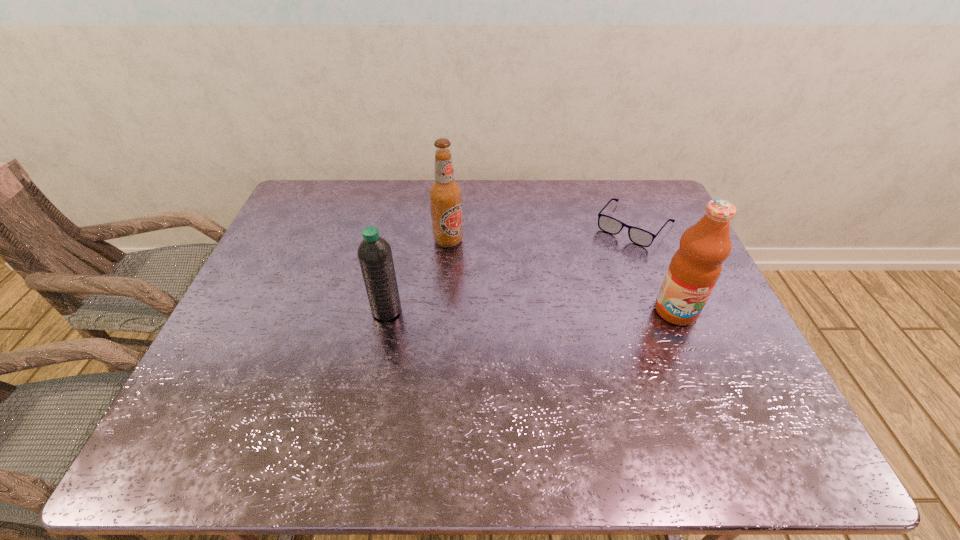
Locate an element on the screen. The image size is (960, 540). the leftmost object is located at coordinates (374, 253).

The width and height of the screenshot is (960, 540). Identify the location of water bottle. (374, 253).

The width and height of the screenshot is (960, 540). In order to click on fruit juice in this screenshot , I will do `click(694, 269)`.

The height and width of the screenshot is (540, 960). I want to click on the shortest object, so click(610, 225).

You are a GUI agent. You are given a task and a screenshot of the screen. Output one action in this format:
    pyautogui.click(x=<x>, y=<y>)
    Task: Click on the third object from right to left
    The image size is (960, 540).
    Given the screenshot: What is the action you would take?
    pyautogui.click(x=445, y=194)

Locate an element on the screen. This screenshot has height=540, width=960. vacant space located 0.260m on the right of the water bottle is located at coordinates (501, 310).

I want to click on vacant area situated 0.220m on the front label of the fruit juice, so click(716, 406).

Locate an element on the screen. This screenshot has width=960, height=540. vacant region located on the front-facing side of the spectacles is located at coordinates (596, 273).

Find the location of a particular element. vacant space positioned 0.200m on the front-facing side of the spectacles is located at coordinates (588, 282).

This screenshot has height=540, width=960. I want to click on vacant space situated on the front-facing side of the spectacles, so click(x=593, y=276).